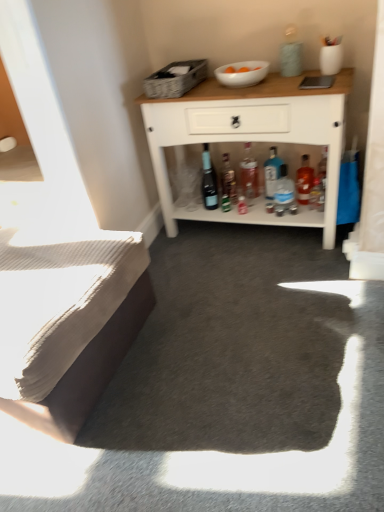
Question: Is beige textured bed at lower left inside translucent glass bottle at center, the sixth bottle in the left-to-right sequence?

Choices:
 (A) yes
 (B) no

Answer: (B)

Question: Considering the relative sizes of translucent glass bottle at center, the sixth bottle in the left-to-right sequence, and beige textured bed at lower left in the image provided, is translucent glass bottle at center, the sixth bottle in the left-to-right sequence, wider than beige textured bed at lower left?

Choices:
 (A) no
 (B) yes

Answer: (A)

Question: Could you tell me if translucent glass bottle at center, marked as the first bottle in a right-to-left arrangement, is facing beige textured bed at lower left?

Choices:
 (A) yes
 (B) no

Answer: (B)

Question: Does translucent glass bottle at center, marked as the first bottle in a right-to-left arrangement, appear on the left side of beige textured bed at lower left?

Choices:
 (A) no
 (B) yes

Answer: (A)

Question: Is matte glass bottle at center, positioned as the first bottle in left-to-right order, taller or shorter than white glossy bowl at upper center?

Choices:
 (A) short
 (B) tall

Answer: (B)

Question: Would you say matte glass bottle at center, the sixth bottle from the right, is to the left or to the right of white glossy bowl at upper center in the picture?

Choices:
 (A) left
 (B) right

Answer: (A)

Question: Which is correct: matte glass bottle at center, the sixth bottle from the right, is inside white glossy bowl at upper center, or outside of it?

Choices:
 (A) inside
 (B) outside

Answer: (B)

Question: Is matte glass bottle at center, the sixth bottle from the right, in front of or behind white glossy bowl at upper center in the image?

Choices:
 (A) behind
 (B) front

Answer: (A)

Question: From the image's perspective, relative to white glossy bowl at upper center, is translucent glass bottle at center, the sixth bottle in the left-to-right sequence, above or below?

Choices:
 (A) below
 (B) above

Answer: (A)

Question: Choose the correct answer: Is translucent glass bottle at center, the sixth bottle in the left-to-right sequence, inside white glossy bowl at upper center or outside it?

Choices:
 (A) inside
 (B) outside

Answer: (B)

Question: Is translucent glass bottle at center, the sixth bottle in the left-to-right sequence, wider or thinner than white glossy bowl at upper center?

Choices:
 (A) wide
 (B) thin

Answer: (B)

Question: Based on their sizes in the image, would you say translucent glass bottle at center, marked as the first bottle in a right-to-left arrangement, is bigger or smaller than white glossy bowl at upper center?

Choices:
 (A) small
 (B) big

Answer: (B)

Question: In the image, is blue glass bottle at center, arranged as the third bottle when viewed from the right, positioned in front of or behind white wood cabinet at upper center?

Choices:
 (A) behind
 (B) front

Answer: (A)

Question: Does point (264, 160) appear closer or farther from the camera than point (175, 232)?

Choices:
 (A) farther
 (B) closer

Answer: (A)